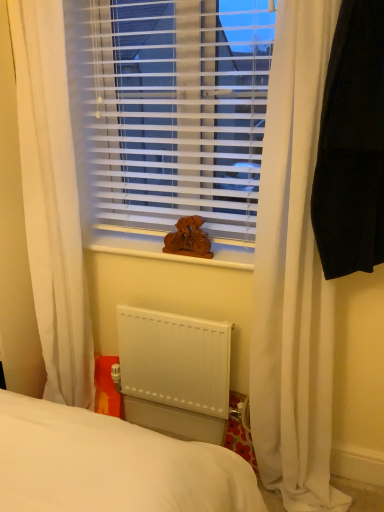
What is the approximate height of white plastic blinds at center?

white plastic blinds at center is 35.22 inches in height.

This screenshot has width=384, height=512. What do you see at coordinates (52, 201) in the screenshot?
I see `white fabric curtain at left, marked as the 2th curtain in a right-to-left arrangement` at bounding box center [52, 201].

What is the approximate width of white fabric curtain at left, which ranks as the 1th curtain in left-to-right order?

16.79 inches.

This screenshot has width=384, height=512. Find the location of `black fabric at right, marked as the first curtain in a right-to-left arrangement`. black fabric at right, marked as the first curtain in a right-to-left arrangement is located at coordinates (352, 145).

What do you see at coordinates (188, 239) in the screenshot? I see `wooden statue at center` at bounding box center [188, 239].

At what (x,y) coordinates should I click in order to perform the action: click on wooden statue at center. Please return your answer as a coordinate pair (x, y). This screenshot has height=512, width=384. Looking at the image, I should click on (168, 254).

Locate an element on the screen. window blind above the wooden statue at center (from the image's perspective) is located at coordinates (169, 112).

From a real-world perspective, is white plastic blinds at center over wooden statue at center?

Yes, from a real-world perspective, white plastic blinds at center is on top of wooden statue at center.

From their relative heights in the image, would you say white plastic blinds at center is taller or shorter than wooden statue at center?

In the image, white plastic blinds at center appears to be taller than wooden statue at center.

In the scene shown: Can wooden statue at center be found inside white plastic blinds at center?

No, white plastic blinds at center does not contain wooden statue at center.

Based on the photo, is black fabric at right, marked as the first curtain in a right-to-left arrangement, looking in the opposite direction of wooden statue at center?

That's not correct — black fabric at right, marked as the first curtain in a right-to-left arrangement, is not looking away from wooden statue at center.

Would you say black fabric at right, marked as the first curtain in a right-to-left arrangement, is to the left or to the right of wooden statue at center in the picture?

In the image, black fabric at right, marked as the first curtain in a right-to-left arrangement, appears on the right side of wooden statue at center.

Is black fabric at right, marked as the first curtain in a right-to-left arrangement, in front of wooden statue at center?

Yes, it is.

Does wooden statue at center have a greater width compared to black fabric at right, the second curtain from the left?

In fact, wooden statue at center might be narrower than black fabric at right, the second curtain from the left.

Does wooden statue at center have a greater height compared to black fabric at right, marked as the first curtain in a right-to-left arrangement?

Incorrect, the height of wooden statue at center is not larger of that of black fabric at right, marked as the first curtain in a right-to-left arrangement.

Is wooden statue at center positioned with its back to black fabric at right, the second curtain from the left?

That's not correct — wooden statue at center is not looking away from black fabric at right, the second curtain from the left.

Are wooden statue at center and black fabric at right, marked as the first curtain in a right-to-left arrangement, located far from each other?

No, there isn't a large distance between wooden statue at center and black fabric at right, marked as the first curtain in a right-to-left arrangement.

Is wooden statue at center positioned with its back to black fabric at right, marked as the first curtain in a right-to-left arrangement?

No.

Is the position of wooden statue at center more distant than that of black fabric at right, the second curtain from the left?

Yes, wooden statue at center is further from the camera.

Is wooden statue at center taller than black fabric at right, marked as the first curtain in a right-to-left arrangement?

No, wooden statue at center is not taller than black fabric at right, marked as the first curtain in a right-to-left arrangement.

Looking at this image, which is further, [96,245] or [349,217]?

The point [96,245] is farther from the camera.

From the picture: How different are the orientations of white fabric curtain at left, which ranks as the 1th curtain in left-to-right order, and wooden statue at center in degrees?

Result: white fabric curtain at left, which ranks as the 1th curtain in left-to-right order, and wooden statue at center are facing 0.106 degrees away from each other.

Is white fabric curtain at left, which ranks as the 1th curtain in left-to-right order, next to wooden statue at center and touching it?

No.

Between white fabric curtain at left, marked as the 2th curtain in a right-to-left arrangement, and wooden statue at center, which one is positioned behind?

wooden statue at center is further from the camera.

Looking at this image, would you say white fabric curtain at left, marked as the 2th curtain in a right-to-left arrangement, is outside wooden statue at center?

Indeed, white fabric curtain at left, marked as the 2th curtain in a right-to-left arrangement, is completely outside wooden statue at center.

Is wooden statue at center facing away from wooden statue at center?

No, wooden statue at center is not facing away from wooden statue at center.

Who is more distant, wooden statue at center or wooden statue at center?

wooden statue at center is behind.

Is point (180, 245) positioned after point (153, 243)?

No, it is in front of (153, 243).

Considering the sizes of objects wooden statue at center and wooden statue at center in the image provided, who is shorter, wooden statue at center or wooden statue at center?

wooden statue at center.

From the image's perspective, is white plastic blinds at center beneath white matte radiator at lower center?

No, from the image's perspective, white plastic blinds at center is not below white matte radiator at lower center.

The height and width of the screenshot is (512, 384). Find the location of `window blind that appears above the white matte radiator at lower center (from the image's perspective)`. window blind that appears above the white matte radiator at lower center (from the image's perspective) is located at coordinates (169, 112).

How many degrees apart are the facing directions of white plastic blinds at center and white matte radiator at lower center?

0.629 degrees separate the facing orientations of white plastic blinds at center and white matte radiator at lower center.

Based on the photo, in the image, is white plastic blinds at center positioned in front of or behind white matte radiator at lower center?

white plastic blinds at center is positioned closer to the viewer than white matte radiator at lower center.

You are a GUI agent. You are given a task and a screenshot of the screen. Output one action in this format:
    pyautogui.click(x=<x>, y=<y>)
    Task: Click on the window sill below the white plastic blinds at center (from the image's perspective)
    The image size is (384, 512).
    Given the screenshot: What is the action you would take?
    pyautogui.click(x=168, y=254)

What are the coordinates of `animal on the left of black fabric at right, the second curtain from the left` in the screenshot? It's located at (188, 239).

Estimate the real-world distances between objects in this image. Which object is closer to white fabric curtain at left, marked as the 2th curtain in a right-to-left arrangement, white plastic blinds at center or wooden statue at center?

white plastic blinds at center is closer to white fabric curtain at left, marked as the 2th curtain in a right-to-left arrangement.

Considering their positions, is wooden statue at center positioned further to white plastic blinds at center than black fabric at right, the second curtain from the left?

black fabric at right, the second curtain from the left, is positioned further to the anchor white plastic blinds at center.

Looking at the image, which one is located closer to white matte radiator at lower center, white fabric curtain at left, which ranks as the 1th curtain in left-to-right order, or wooden statue at center?

wooden statue at center.

From the picture: From the image, which object appears to be farther from wooden statue at center, black fabric at right, marked as the first curtain in a right-to-left arrangement, or white plastic blinds at center?

black fabric at right, marked as the first curtain in a right-to-left arrangement.

Estimate the real-world distances between objects in this image. Which object is closer to white fabric curtain at left, which ranks as the 1th curtain in left-to-right order, wooden statue at center or black fabric at right, marked as the first curtain in a right-to-left arrangement?

wooden statue at center is positioned closer to the anchor white fabric curtain at left, which ranks as the 1th curtain in left-to-right order.

From the image, which object appears to be farther from wooden statue at center, white plastic blinds at center or white matte radiator at lower center?

Among the two, white matte radiator at lower center is located further to wooden statue at center.

Based on the photo, considering their positions, is black fabric at right, the second curtain from the left, positioned closer to white plastic blinds at center than wooden statue at center?

Among the two, wooden statue at center is located nearer to white plastic blinds at center.

When comparing their distances from white plastic blinds at center, does black fabric at right, the second curtain from the left, or wooden statue at center seem closer?

wooden statue at center is closer to white plastic blinds at center.

The image size is (384, 512). In order to click on window sill between black fabric at right, the second curtain from the left, and wooden statue at center in the front-back direction in this screenshot , I will do `click(168, 254)`.

This screenshot has height=512, width=384. What are the coordinates of `window sill between black fabric at right, marked as the first curtain in a right-to-left arrangement, and white matte radiator at lower center, in the vertical direction` in the screenshot? It's located at (168, 254).

At what (x,y) coordinates should I click in order to perform the action: click on radiator between white fabric curtain at left, marked as the 2th curtain in a right-to-left arrangement, and black fabric at right, the second curtain from the left. Please return your answer as a coordinate pair (x, y). The width and height of the screenshot is (384, 512). Looking at the image, I should click on (175, 360).

Find the location of `window blind between black fabric at right, marked as the first curtain in a right-to-left arrangement, and wooden statue at center, along the z-axis`. window blind between black fabric at right, marked as the first curtain in a right-to-left arrangement, and wooden statue at center, along the z-axis is located at coordinates (169, 112).